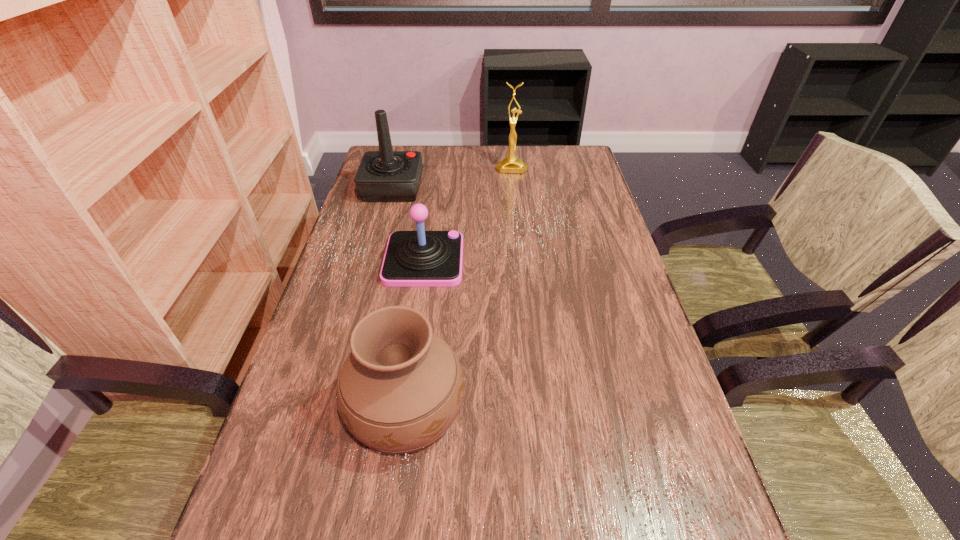
At what (x,y) coordinates should I click in order to perform the action: click on award that is at the far edge. Please return your answer as a coordinate pair (x, y). Looking at the image, I should click on (511, 164).

I want to click on joystick at the far edge, so click(x=383, y=176).

Identify the location of urn present at the left edge. (400, 389).

You are a GUI agent. You are given a task and a screenshot of the screen. Output one action in this format:
    pyautogui.click(x=<x>, y=<y>)
    Task: Click on the object present at the far left corner
    
    Given the screenshot: What is the action you would take?
    pyautogui.click(x=383, y=176)

Where is `vacant space at the far edge of the desktop`? The image size is (960, 540). vacant space at the far edge of the desktop is located at coordinates (477, 149).

At what (x,y) coordinates should I click in order to perform the action: click on free space at the left edge of the desktop. Please return your answer as a coordinate pair (x, y). Looking at the image, I should click on (389, 288).

This screenshot has height=540, width=960. I want to click on free space at the right edge of the desktop, so tap(606, 207).

In the image, there is a desktop. Find the location of `vacant space at the far right corner`. vacant space at the far right corner is located at coordinates (556, 147).

I want to click on vacant point located between the award and the second shortest object, so click(x=459, y=287).

The height and width of the screenshot is (540, 960). In order to click on free space between the shorter joystick and the taller joystick in this screenshot , I will do `click(408, 224)`.